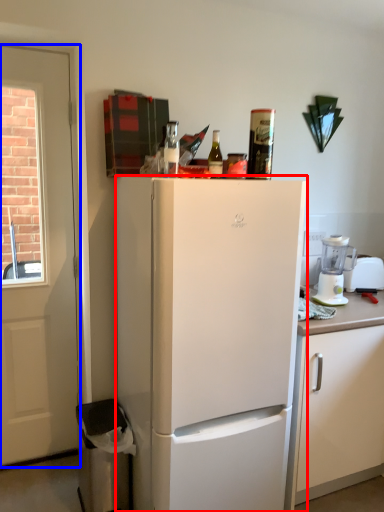
Question: Which object is closer to the camera taking this photo, refrigerator (highlighted by a red box) or door (highlighted by a blue box)?

Choices:
 (A) refrigerator
 (B) door

Answer: (A)